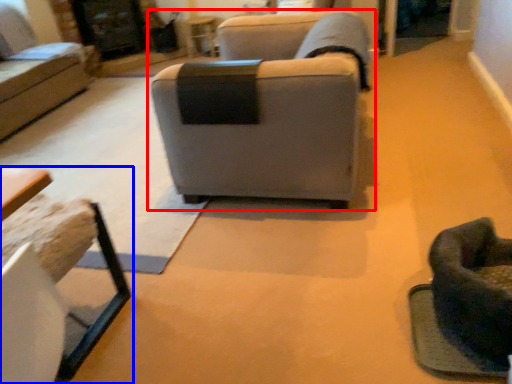
Question: Which of the following is the closest to the observer, studio couch (highlighted by a red box) or table (highlighted by a blue box)?

Choices:
 (A) studio couch
 (B) table

Answer: (B)